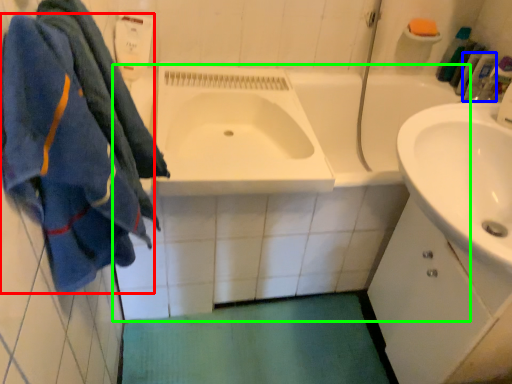
Question: Which object is the farthest from bath towel (highlighted by a red box)? Choose among these: toiletry (highlighted by a blue box) or bath (highlighted by a green box).

Choices:
 (A) toiletry
 (B) bath

Answer: (A)